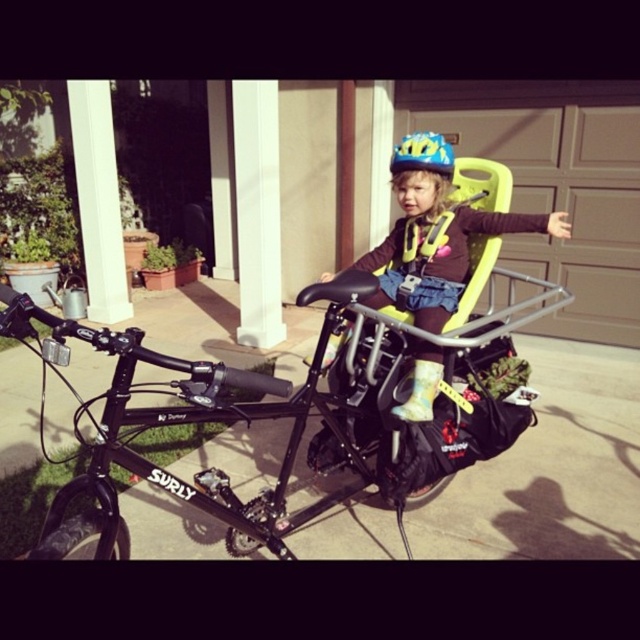
Question: Observing the image, what is the correct spatial positioning of black matte surly bike at center in reference to blue matte helmet at center?

Choices:
 (A) right
 (B) left

Answer: (B)

Question: Which object is positioned closest to the black matte surly bike at center?

Choices:
 (A) blue matte helmet at center
 (B) matte yellow helmet at center

Answer: (B)

Question: Is the position of matte yellow helmet at center more distant than that of blue matte helmet at center?

Choices:
 (A) no
 (B) yes

Answer: (A)

Question: Which point is closer to the camera?

Choices:
 (A) click(x=429, y=150)
 (B) click(x=410, y=273)
 (C) click(x=490, y=436)

Answer: (C)

Question: Can you confirm if black matte surly bike at center is positioned below blue matte helmet at center?

Choices:
 (A) yes
 (B) no

Answer: (A)

Question: Which object appears farthest from the camera in this image?

Choices:
 (A) black matte surly bike at center
 (B) blue matte helmet at center
 (C) matte yellow helmet at center

Answer: (B)